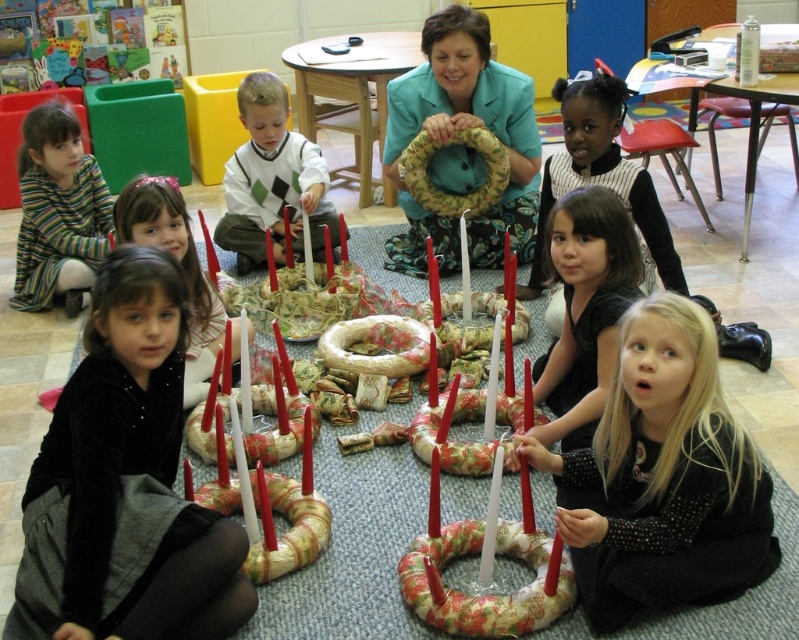
Is black textured sweater at lower right below striped knit sweater at lower left?

Yes, black textured sweater at lower right is below striped knit sweater at lower left.

Which is more to the left, black textured sweater at lower right or striped knit sweater at lower left?

Positioned to the left is striped knit sweater at lower left.

Does point (664, 364) come farther from viewer compared to point (22, 184)?

No, (664, 364) is in front of (22, 184).

Find the location of a particular element. The width and height of the screenshot is (799, 640). black textured sweater at lower right is located at coordinates (662, 477).

Is floral fabric wreath at center taller than striped knit sweater at lower left?

Yes, floral fabric wreath at center is taller than striped knit sweater at lower left.

Between floral fabric wreath at center and striped knit sweater at lower left, which one appears on the left side from the viewer's perspective?

striped knit sweater at lower left is more to the left.

Is point (430, 216) less distant than point (44, 266)?

No, (430, 216) is behind (44, 266).

Where is `floral fabric wreath at center`? This screenshot has width=799, height=640. floral fabric wreath at center is located at coordinates (462, 129).

Can you confirm if velvet black dress at lower left is positioned to the left of black textured dress at lower right?

Indeed, velvet black dress at lower left is positioned on the left side of black textured dress at lower right.

Where is `velvet black dress at lower left`? This screenshot has width=799, height=640. velvet black dress at lower left is located at coordinates (125, 483).

At what (x,y) coordinates should I click in order to perform the action: click on velvet black dress at lower left. Please return your answer as a coordinate pair (x, y). The width and height of the screenshot is (799, 640). Looking at the image, I should click on (125, 483).